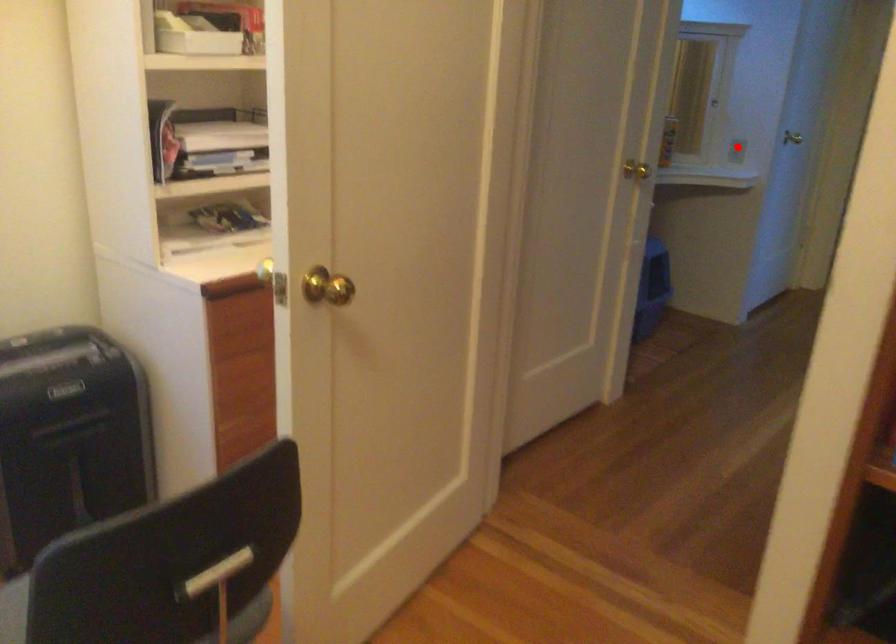
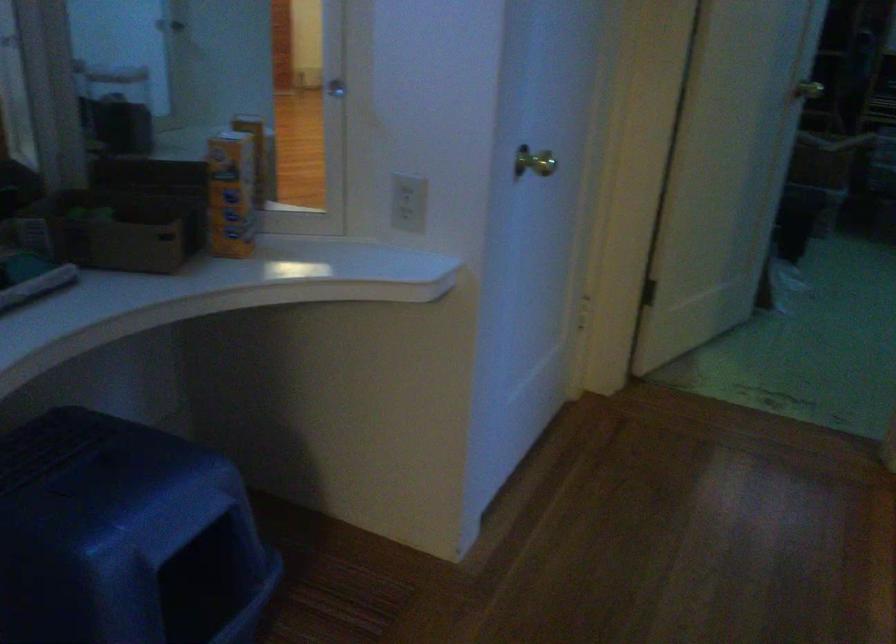
In the second image, find the point that corresponds to the highlighted location in the first image.

(409, 202)